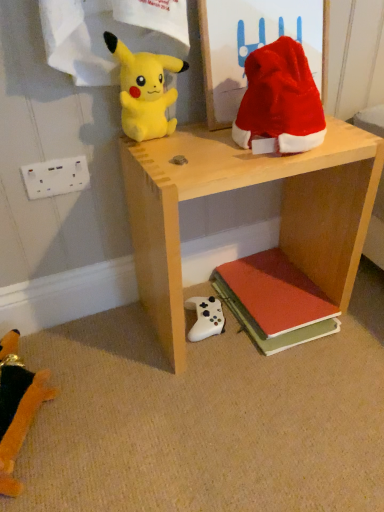
Locate an element on the screen. The width and height of the screenshot is (384, 512). vacant area that lies between velvet orange stuffed toy at lower left, which ranks as the fourth toy in right-to-left order, and white matte game controller at lower center, placed as the third toy when sorted from top to bottom is located at coordinates (116, 372).